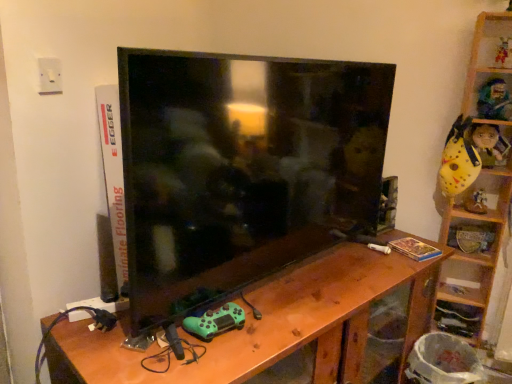
Question: Is green matte controller at lower center, which is counted as the first toy, starting from the bottom, in front of wooden at right, acting as the 1th shelf starting from the bottom?

Choices:
 (A) yes
 (B) no

Answer: (A)

Question: Considering the relative sizes of green matte controller at lower center, which is counted as the first toy, starting from the bottom, and wooden at right, acting as the 1th shelf starting from the bottom, in the image provided, is green matte controller at lower center, which is counted as the first toy, starting from the bottom, smaller than wooden at right, acting as the 1th shelf starting from the bottom,?

Choices:
 (A) yes
 (B) no

Answer: (A)

Question: Can you confirm if green matte controller at lower center, which is counted as the first toy, starting from the bottom, is bigger than wooden at right, the 2th shelf positioned from the top?

Choices:
 (A) yes
 (B) no

Answer: (B)

Question: From the image's perspective, is green matte controller at lower center, arranged as the 1th toy when viewed from the left, under wooden at right, the 2th shelf positioned from the top?

Choices:
 (A) no
 (B) yes

Answer: (B)

Question: Is green matte controller at lower center, the fifth toy when ordered from back to front, oriented towards wooden at right, the 2th shelf positioned from the top?

Choices:
 (A) yes
 (B) no

Answer: (B)

Question: Is wooden at right, the 2th shelf positioned from the top, spatially inside wooden table at center, or outside of it?

Choices:
 (A) outside
 (B) inside

Answer: (A)

Question: From a real-world perspective, relative to wooden table at center, is wooden at right, acting as the 1th shelf starting from the bottom, vertically above or below?

Choices:
 (A) below
 (B) above

Answer: (B)

Question: Is wooden at right, the 2th shelf positioned from the top, in front of or behind wooden table at center in the image?

Choices:
 (A) behind
 (B) front

Answer: (A)

Question: Considering the positions of wooden at right, the 2th shelf positioned from the top, and wooden table at center in the image, is wooden at right, the 2th shelf positioned from the top, taller or shorter than wooden table at center?

Choices:
 (A) short
 (B) tall

Answer: (A)

Question: Looking at their shapes, would you say wooden at right, the 2th shelf positioned from the top, is wider or thinner than wooden at right, which is the second shelf from bottom to top?

Choices:
 (A) thin
 (B) wide

Answer: (A)

Question: Does point (477, 233) appear closer or farther from the camera than point (460, 286)?

Choices:
 (A) farther
 (B) closer

Answer: (B)

Question: Considering their positions, is wooden at right, acting as the 1th shelf starting from the bottom, located in front of or behind wooden at right, positioned as the first shelf in top-to-bottom order?

Choices:
 (A) front
 (B) behind

Answer: (B)

Question: Is wooden at right, the 2th shelf positioned from the top, inside or outside of wooden at right, which is the second shelf from bottom to top?

Choices:
 (A) outside
 (B) inside

Answer: (B)

Question: In the image, is green matte controller at lower center, arranged as the 5th toy when viewed from the right, on the left side or the right side of matte black tv at center?

Choices:
 (A) left
 (B) right

Answer: (A)

Question: From the image's perspective, is green matte controller at lower center, arranged as the 5th toy when viewed from the right, above or below matte black tv at center?

Choices:
 (A) above
 (B) below

Answer: (B)